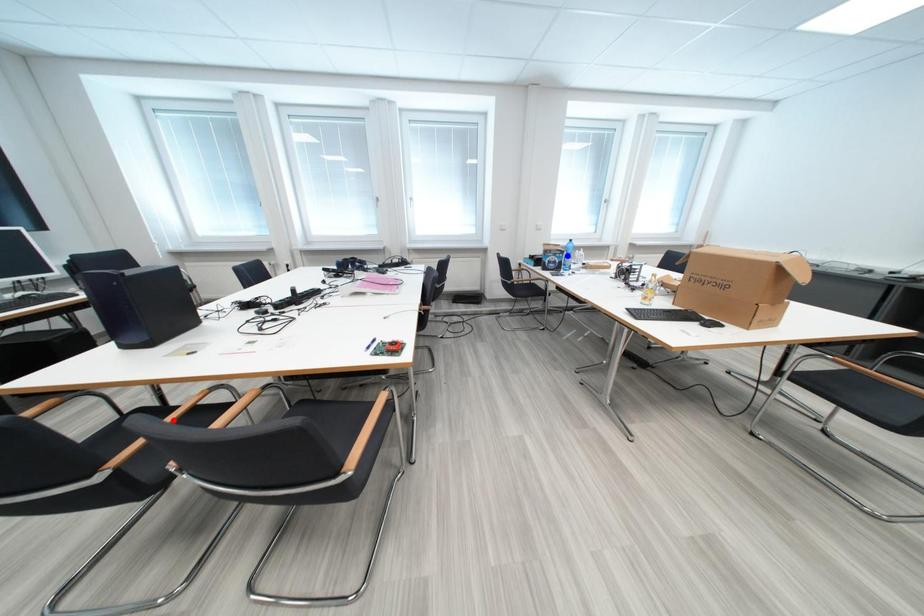
Question: Which of the two points in the image is closer to the camera?

Choices:
 (A) Blue point is closer.
 (B) Red point is closer.

Answer: (B)